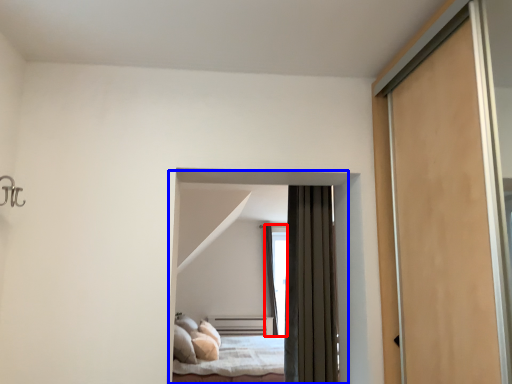
Question: Which point is further to the camera, window (highlighted by a red box) or bed (highlighted by a blue box)?

Choices:
 (A) window
 (B) bed

Answer: (A)